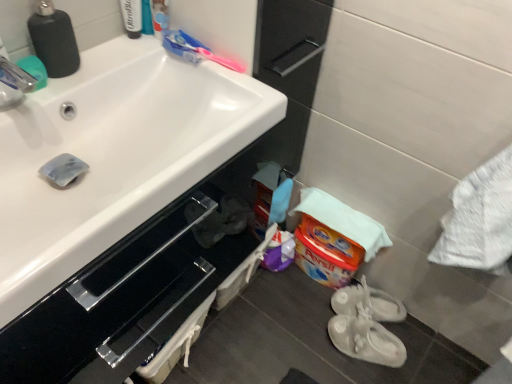
Where is `vacant region in front of white glossy tube at upper left, which ranks as the 2th toiletry in right-to-left order`? vacant region in front of white glossy tube at upper left, which ranks as the 2th toiletry in right-to-left order is located at coordinates (111, 63).